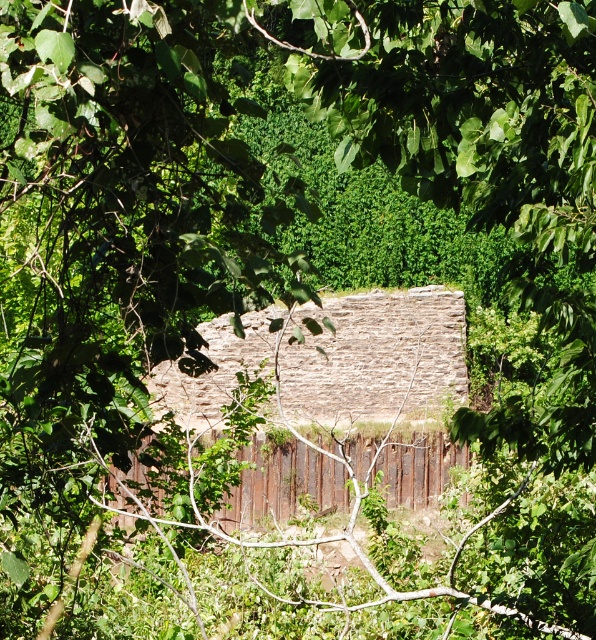
Question: Is rustic stone hut at center in front of rusty metal fence at center?

Choices:
 (A) yes
 (B) no

Answer: (B)

Question: Can you confirm if rustic stone hut at center is positioned to the right of rusty metal fence at center?

Choices:
 (A) yes
 (B) no

Answer: (A)

Question: Where is rustic stone hut at center located in relation to rusty metal fence at center in the image?

Choices:
 (A) above
 (B) below

Answer: (A)

Question: Which point is closer to the camera?

Choices:
 (A) rustic stone hut at center
 (B) rusty metal fence at center

Answer: (B)

Question: Which object appears farthest from the camera in this image?

Choices:
 (A) rustic stone hut at center
 (B) rusty metal fence at center

Answer: (A)

Question: Which of the following is the closest to the observer?

Choices:
 (A) (316, 456)
 (B) (390, 502)

Answer: (A)